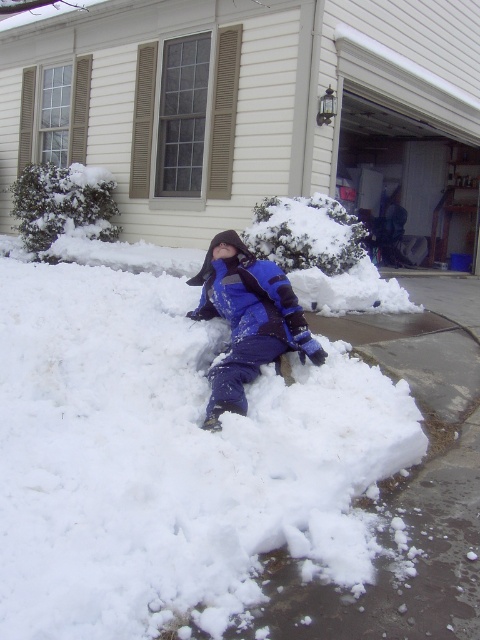
Question: Can you confirm if white fluffy snow at center is positioned to the left of blue fleece jacket at center?

Choices:
 (A) yes
 (B) no

Answer: (A)

Question: Which of the following is the farthest from the observer?

Choices:
 (A) (162, 518)
 (B) (247, 378)

Answer: (B)

Question: Does white fluffy snow at center appear on the right side of blue fleece jacket at center?

Choices:
 (A) yes
 (B) no

Answer: (B)

Question: Which point appears farthest from the camera in this image?

Choices:
 (A) (235, 339)
 (B) (261, 593)

Answer: (A)

Question: In this image, where is white fluffy snow at center located relative to blue fleece jacket at center?

Choices:
 (A) right
 (B) left

Answer: (B)